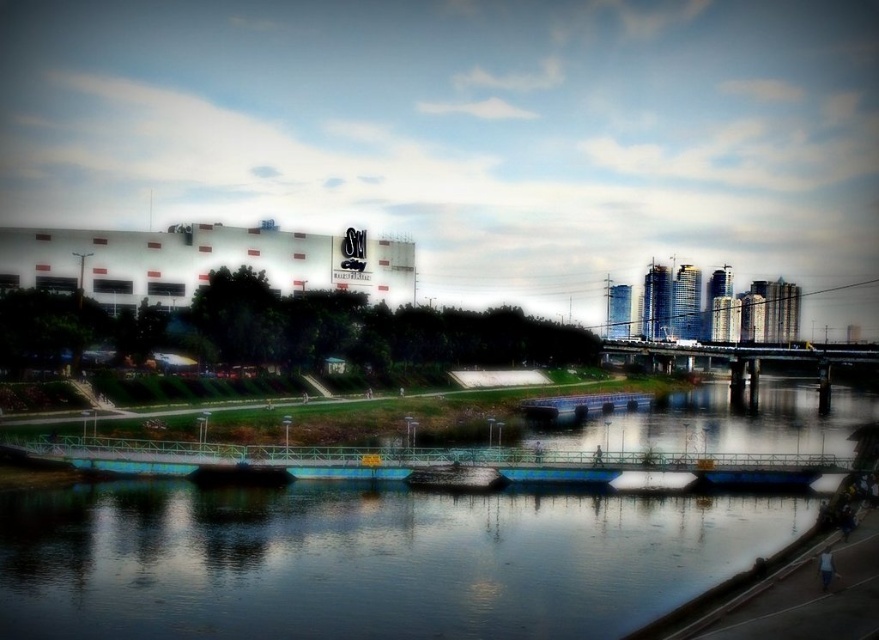
Can you confirm if blue smooth water at center is taller than shiny dark wood boat at center?

Yes.

This screenshot has height=640, width=879. Describe the element at coordinates (365, 561) in the screenshot. I see `blue smooth water at center` at that location.

Does point (790, 529) come closer to viewer compared to point (488, 468)?

Yes.

Locate an element on the screen. blue smooth water at center is located at coordinates (365, 561).